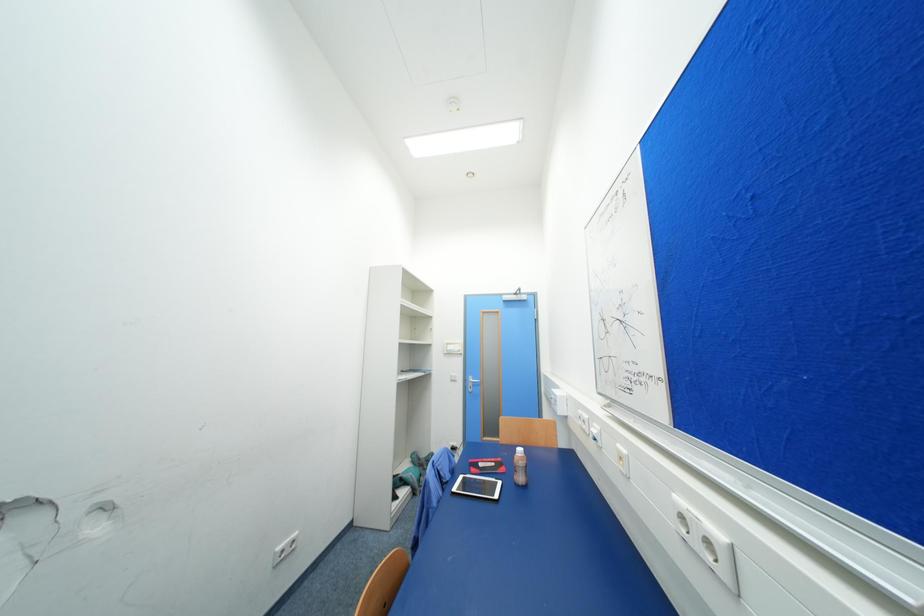
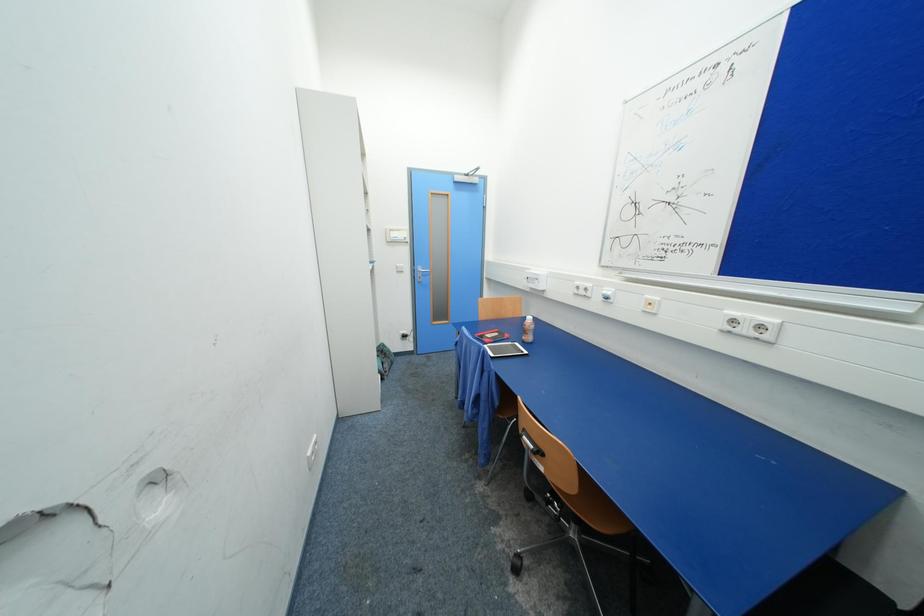
How did the camera likely rotate?

The camera's rotation is toward right-down.